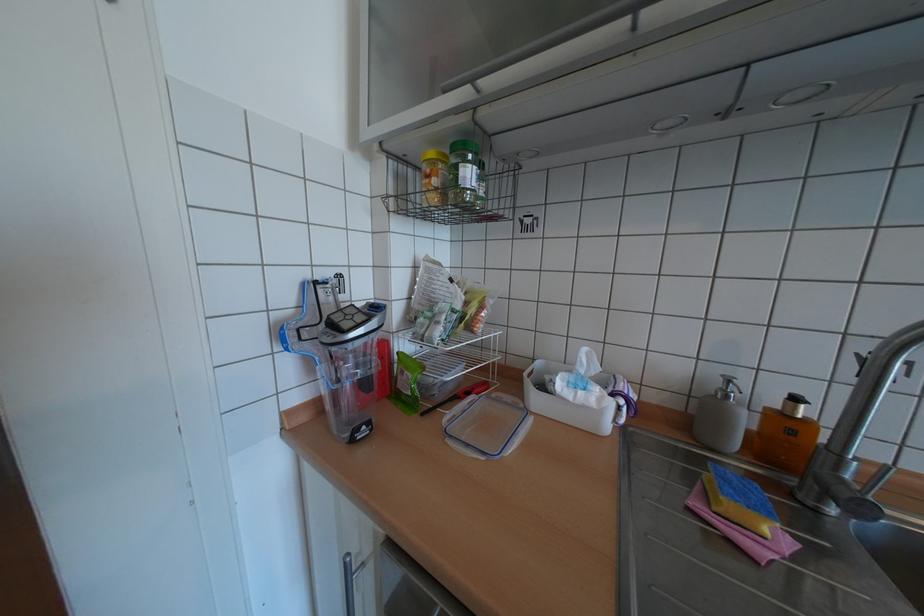
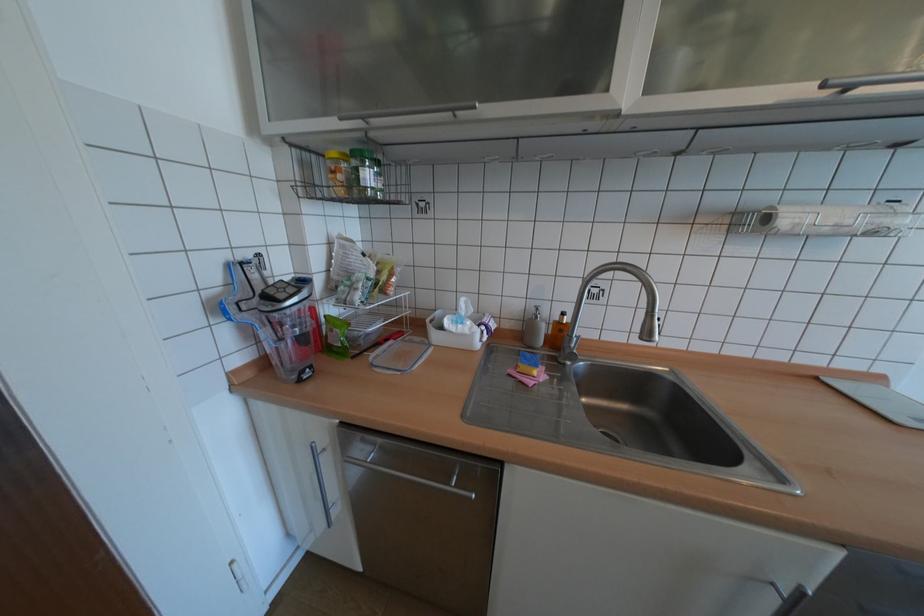
Find the pixel in the second image that matches (x=457, y=421) in the first image.

(383, 358)